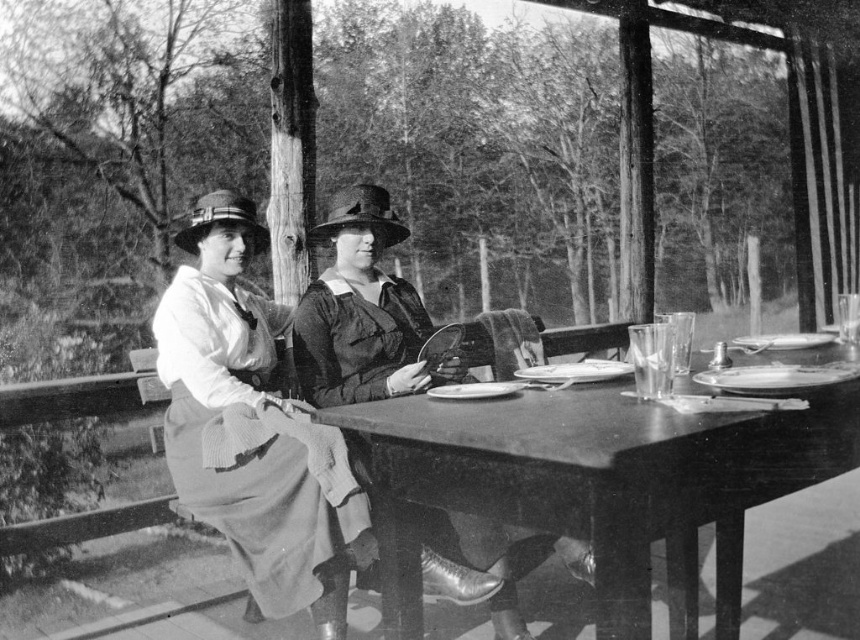
Is wooden table at center smaller than matte white blouse at center?

Yes.

Does wooden table at center lie in front of matte white blouse at center?

Yes, it is.

Does point (613, 454) lie in front of point (175, 468)?

Yes, it is in front of point (175, 468).

Where is `wooden table at center`? The height and width of the screenshot is (640, 860). wooden table at center is located at coordinates [x=597, y=484].

How distant is matte white blouse at center from matte black dress at center?

matte white blouse at center is 14.74 inches from matte black dress at center.

Between matte white blouse at center and matte black dress at center, which one appears on the right side from the viewer's perspective?

matte black dress at center is more to the right.

Between point (312, 504) and point (566, 563), which one is positioned in front?

Point (312, 504) is more forward.

You are a GUI agent. You are given a task and a screenshot of the screen. Output one action in this format:
    pyautogui.click(x=<x>, y=<y>)
    Task: Click on the matte white blouse at center
    The width and height of the screenshot is (860, 640).
    Given the screenshot: What is the action you would take?
    pyautogui.click(x=250, y=428)

Is wooden table at center taller than matte black dress at center?

Incorrect, wooden table at center's height is not larger of matte black dress at center's.

The width and height of the screenshot is (860, 640). I want to click on wooden table at center, so click(597, 484).